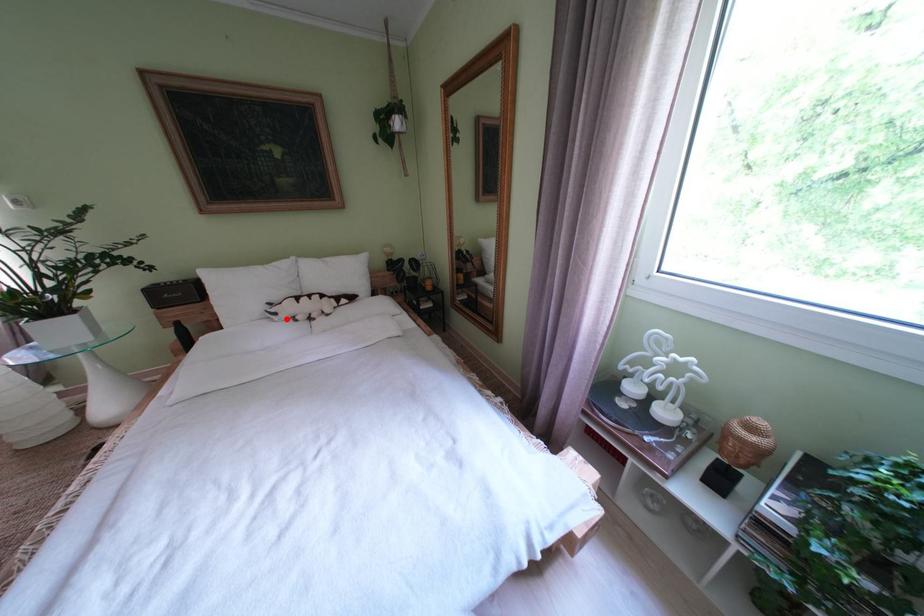
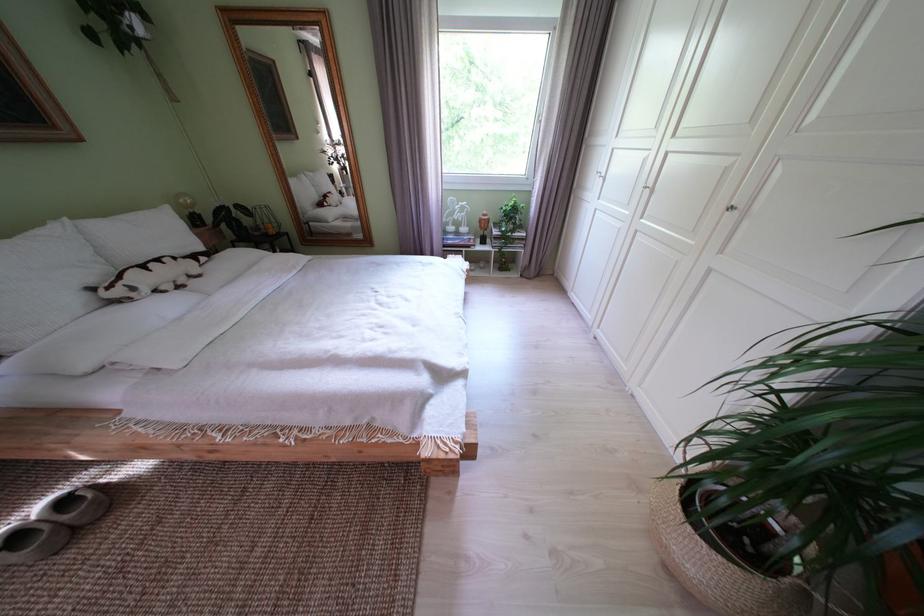
The point at the highlighted location is marked in the first image. Where is the corresponding point in the second image?

(146, 294)